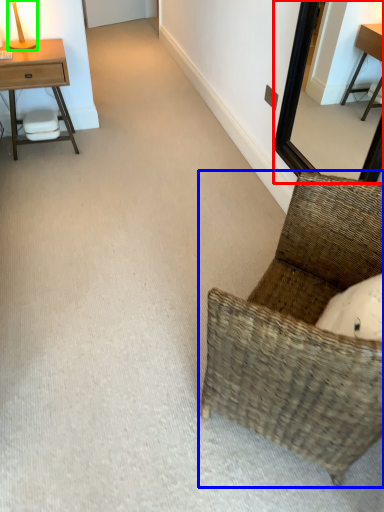
Question: Considering the real-world distances, which object is closest to mirror (highlighted by a red box)? chair (highlighted by a blue box) or table lamp (highlighted by a green box).

Choices:
 (A) chair
 (B) table lamp

Answer: (A)